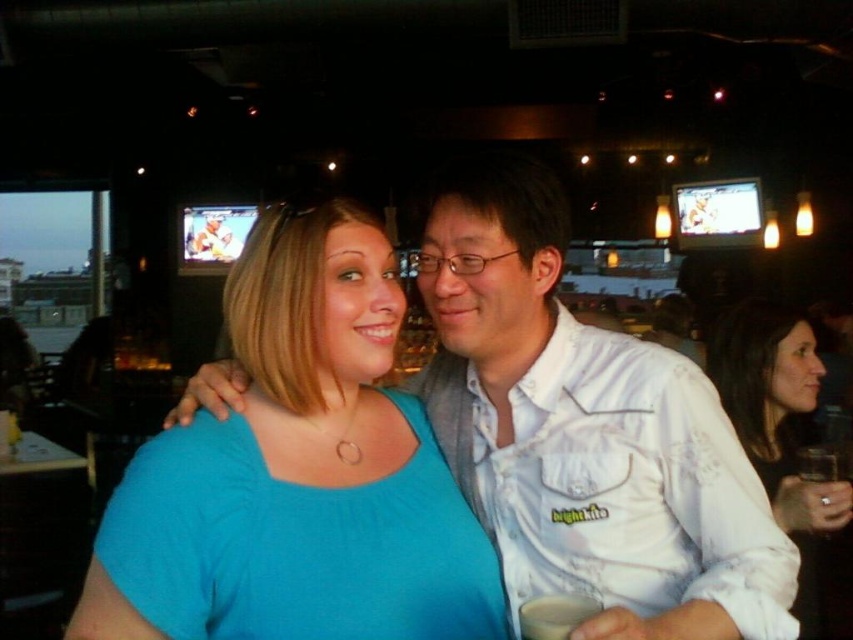
Who is taller, matte blue shirt at center or white cotton shirt at center?

white cotton shirt at center is taller.

Who is lower down, matte blue shirt at center or white cotton shirt at center?

white cotton shirt at center is lower down.

Which is behind, point (234, 280) or point (612, 404)?

The point (234, 280) is behind.

This screenshot has height=640, width=853. In order to click on matte blue shirt at center in this screenshot , I will do coord(297,474).

Is point (711, 512) positioned behind point (550, 600)?

Yes, it is.

Between white cotton shirt at center and white matte cup at center, which one is positioned lower?

Positioned lower is white matte cup at center.

Does point (532, 198) come behind point (532, 637)?

Yes.

Image resolution: width=853 pixels, height=640 pixels. I want to click on white cotton shirt at center, so click(585, 433).

Does matte blue shirt at center have a lesser height compared to white matte cup at center?

Incorrect, matte blue shirt at center's height does not fall short of white matte cup at center's.

Who is positioned more to the left, matte blue shirt at center or white matte cup at center?

matte blue shirt at center

Who is more forward, [347,422] or [548,605]?

Positioned in front is point [548,605].

Locate an element on the screen. The height and width of the screenshot is (640, 853). matte blue shirt at center is located at coordinates (297, 474).